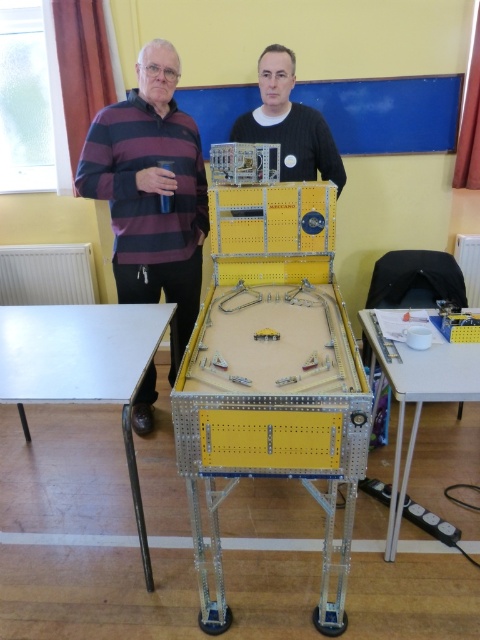
Between white plastic table at lower right and black matte shirt at center, which one is positioned lower?

Positioned lower is white plastic table at lower right.

Is white plastic table at lower right in front of black matte shirt at center?

Yes, white plastic table at lower right is in front of black matte shirt at center.

Describe the element at coordinates (417, 396) in the screenshot. I see `white plastic table at lower right` at that location.

This screenshot has height=640, width=480. What are the coordinates of `white plastic table at lower right` in the screenshot? It's located at (417, 396).

Who is higher up, striped sweater at left or white matte table at lower left?

striped sweater at left

Is striped sweater at left positioned before white matte table at lower left?

No.

Who is more forward, [146,104] or [126,440]?

Positioned in front is point [126,440].

Image resolution: width=480 pixels, height=640 pixels. I want to click on striped sweater at left, so click(x=151, y=188).

What do you see at coordinates (272, 378) in the screenshot?
I see `metallic yellow pinball machine at center` at bounding box center [272, 378].

Can you confirm if metallic yellow pinball machine at center is wider than white matte table at lower left?

No, metallic yellow pinball machine at center is not wider than white matte table at lower left.

I want to click on metallic yellow pinball machine at center, so click(272, 378).